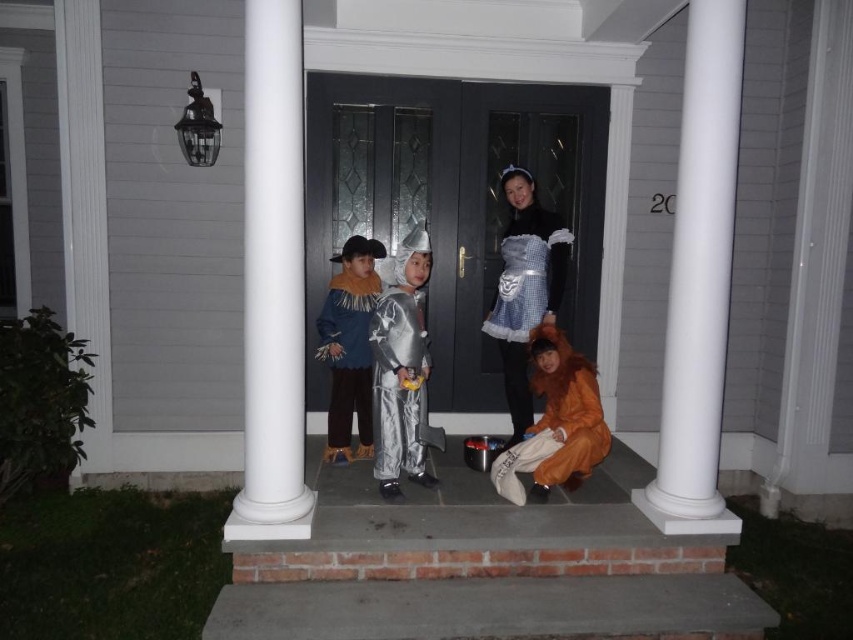
You are a photographer trying to capture a clear shot of both the white smooth column at center and the white gingham dress at center. Based on their positions, which object should you focus on first to ensure both are in focus?

The white smooth column at center is closer to the viewer than the white gingham dress at center, so focus on the white smooth column at center first to ensure both are in focus.

You are a photographer trying to capture a group photo of the shiny silver costume at center and the orange plush costume at lower right. Based on their sizes, which costume should you position closer to the camera to make them appear similar in size in the photo?

Since the shiny silver costume at center is much taller than the orange plush costume at lower right, you should position the orange plush costume at lower right closer to the camera to balance their apparent sizes in the photo.